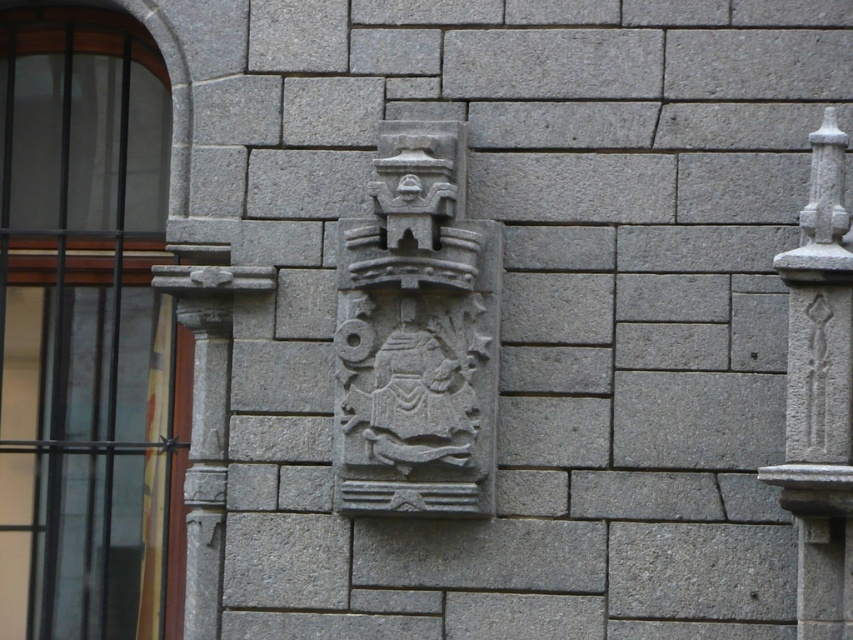
You are an architect examining the stone wall and need to install a new light fixture. The fixture requires mounting above the matte glass window at center left but must not interfere with the gray stone crest at center. Can you mount the light fixture there?

The matte glass window at center left is positioned under the gray stone crest at center, so installing a light fixture above the matte glass window at center left would place it directly below the gray stone crest at center. This might interfere with the crest, so it is not advisable to mount the light fixture there.

You are an architect analyzing the symmetry of the stone wall. The wall has a central axis running vertically through its midpoint. Based on the position of the gray stone crest at center, does it align with the wall s central axis? Please explain your reasoning.

The gray stone crest at center is located at coordinates approximately 0.523 on the x and 0.489 on the y. Since the central axis of the wall would be at x 0.5, the crest is very close to but slightly to the right of the central axis. Therefore, it does not perfectly align with the wall s central axis.

You are standing in front of the stone wall and want to look through the matte glass window at center left. Which direction should you turn your head to face the gray stone pillar at right?

To face the gray stone pillar at right from the matte glass window at center left, you should turn your head to the right since the gray stone pillar at right is located to the right of the matte glass window at center left.